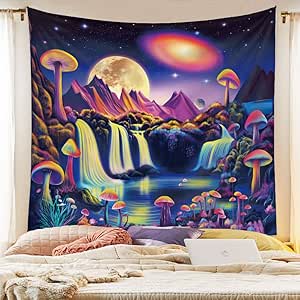
Identify the location of laptop. (246, 246).